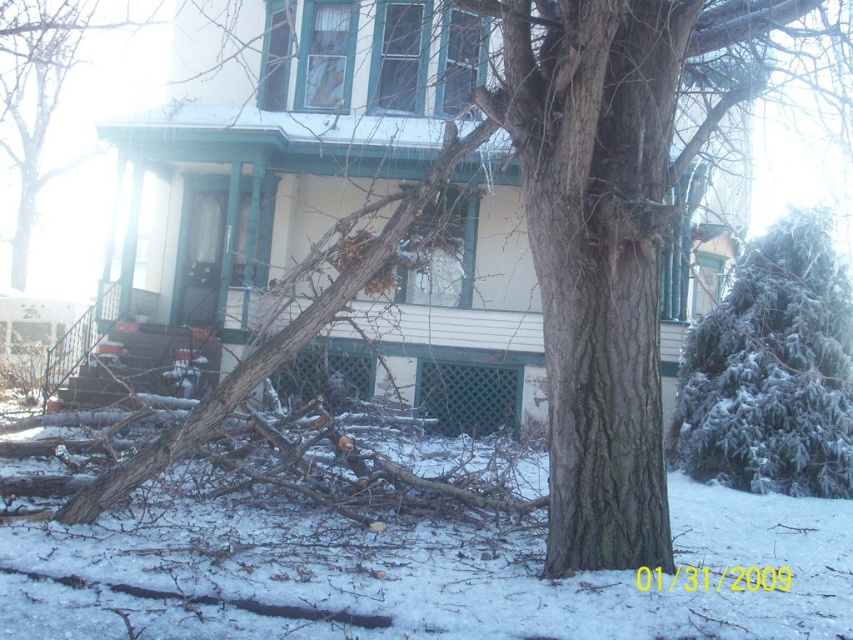
Question: Is the position of green textured evergreen at right more distant than that of brown rough bark tree at upper center?

Choices:
 (A) yes
 (B) no

Answer: (B)

Question: Which point appears closest to the camera in this image?

Choices:
 (A) (843, 410)
 (B) (125, 72)

Answer: (A)

Question: Does green textured evergreen at right have a lesser width compared to brown rough bark tree at upper center?

Choices:
 (A) no
 (B) yes

Answer: (A)

Question: Does green textured evergreen at right have a smaller size compared to brown rough bark tree at upper center?

Choices:
 (A) no
 (B) yes

Answer: (A)